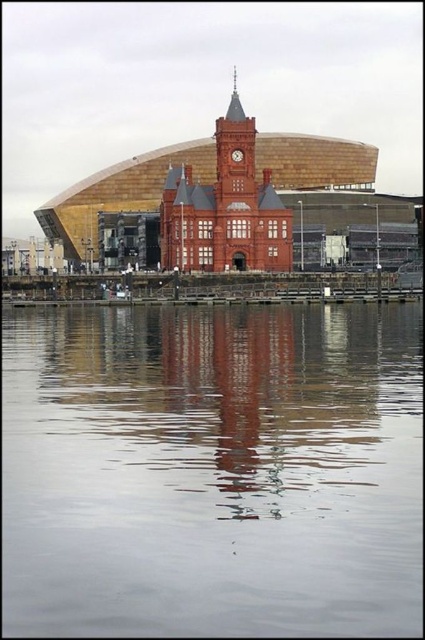
Is smooth gray water at center positioned at the back of matte brick clock tower at center?

No, smooth gray water at center is in front of matte brick clock tower at center.

Is smooth gray water at center to the right of matte brick clock tower at center from the viewer's perspective?

Yes, smooth gray water at center is to the right of matte brick clock tower at center.

Find the location of a particular element. The height and width of the screenshot is (640, 425). smooth gray water at center is located at coordinates (212, 470).